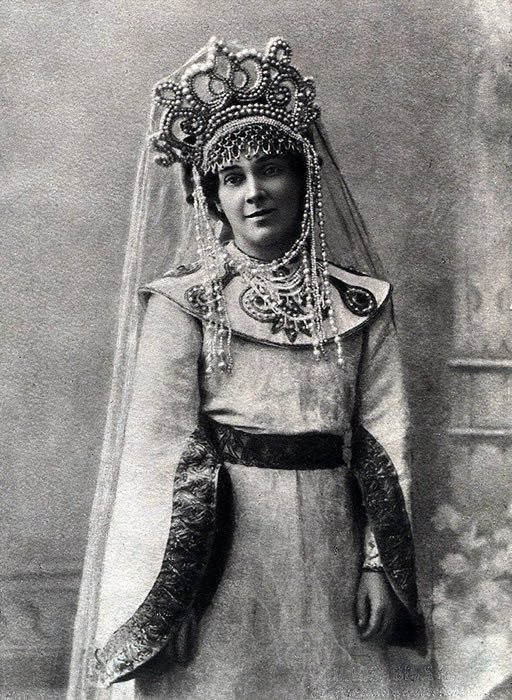
At what (x,y) coordinates should I click in order to perform the action: click on floor design. Please return your answer as a coordinate pair (x, y). Looking at the image, I should click on (39, 603).